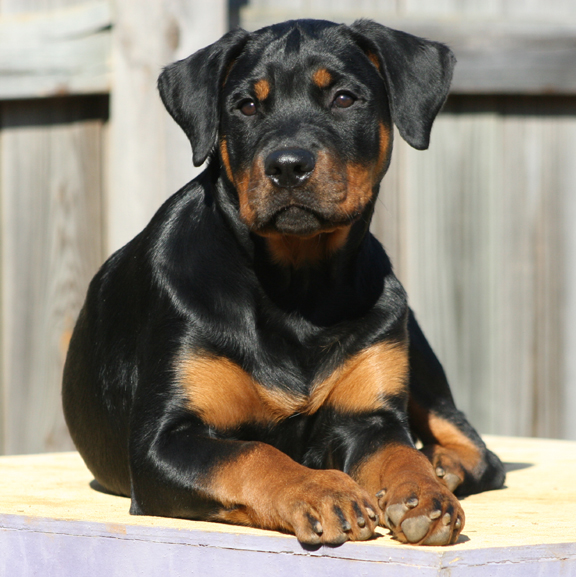
Where is `right front leg`? This screenshot has width=576, height=577. right front leg is located at coordinates (246, 477).